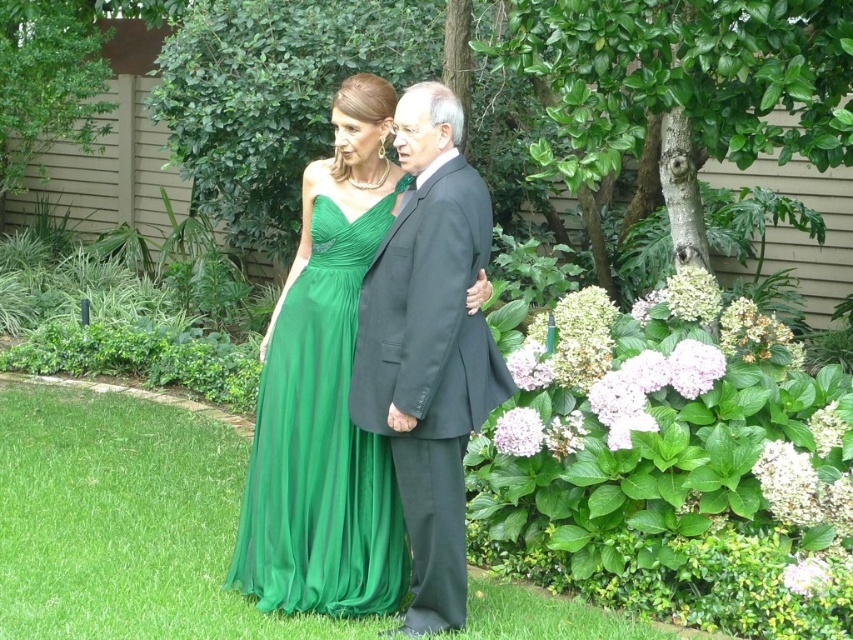
You are a photographer planning to take a portrait of the two people in the image. You want to ensure that both the matte black suit at center and the emerald green chiffon dress at center are clearly visible in the frame. Given their sizes, which clothing item might require more careful positioning to avoid being overshadowed?

The emerald green chiffon dress at center might require more careful positioning since it is smaller in size compared to the matte black suit at center, which is larger. This ensures it remains visible and balanced in the composition.